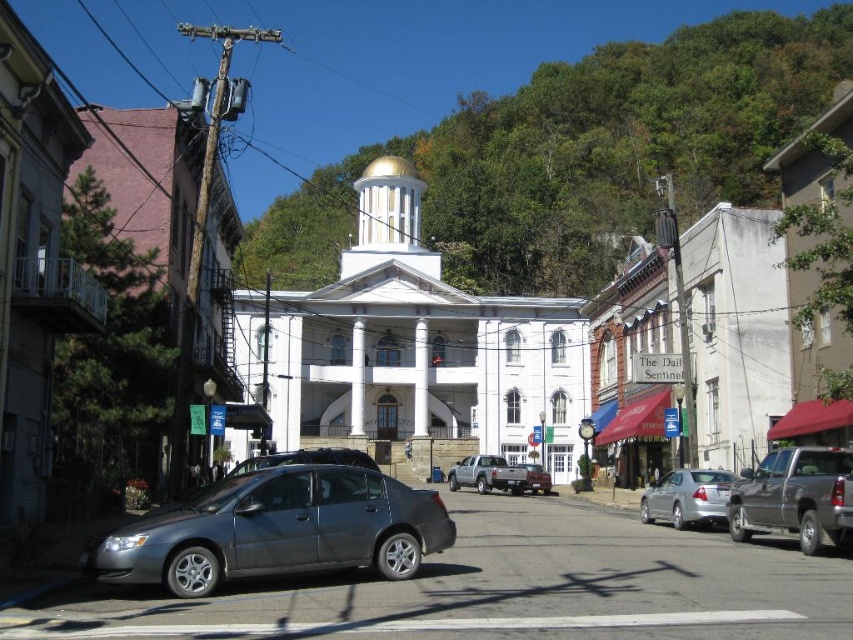
Between point (815, 515) and point (682, 486), which one is positioned behind?

The point (682, 486) is behind.

Can you confirm if metallic gray truck at center right is bigger than silver metallic sedan at center?

No.

Which is in front, point (782, 477) or point (671, 509)?

Point (782, 477) is more forward.

Identify the location of metallic gray truck at center right. (795, 497).

Is point (316, 563) positioned before point (543, 493)?

Yes, point (316, 563) is closer to viewer.

Which is behind, point (212, 500) or point (540, 483)?

Point (540, 483)

At what (x,y) coordinates should I click in order to perform the action: click on satin gray sedan at lower left. Please return your answer as a coordinate pair (x, y). The width and height of the screenshot is (853, 640). Looking at the image, I should click on (279, 529).

Between satin gray sedan at lower left and silver metallic truck at center, which one has more height?

Standing taller between the two is satin gray sedan at lower left.

Identify the location of satin gray sedan at lower left. This screenshot has width=853, height=640. (279, 529).

Between point (320, 518) and point (469, 460), which one is positioned in front?

Point (320, 518) is in front.

Locate an element on the screen. satin gray sedan at lower left is located at coordinates (279, 529).